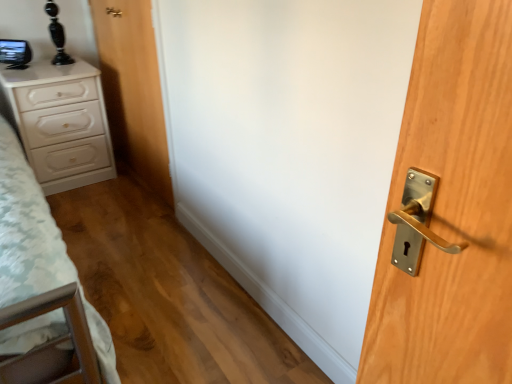
Locate an element on the screen. vacant space in front of wooden door at center is located at coordinates (122, 220).